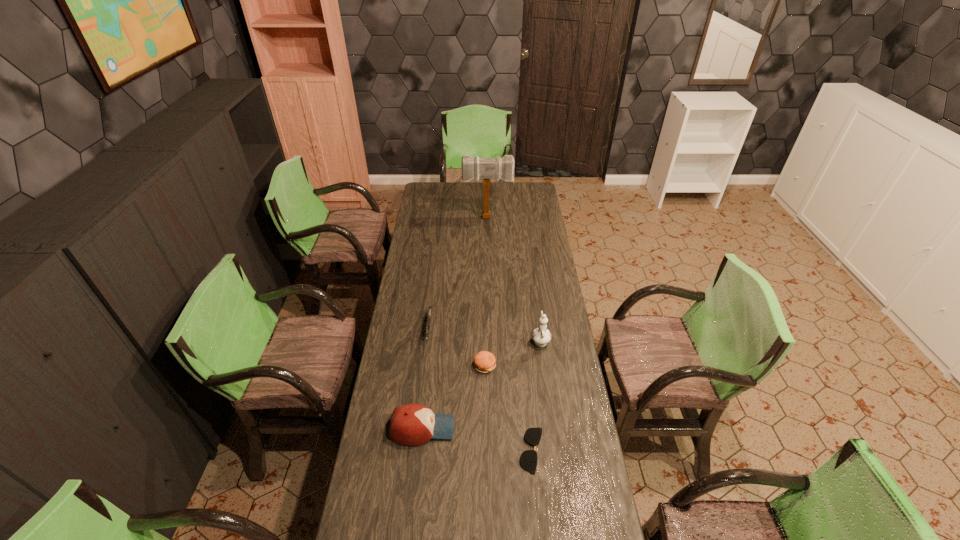
Locate an element on the screen. mallet is located at coordinates (476, 168).

Where is `the farthest object`? Image resolution: width=960 pixels, height=540 pixels. the farthest object is located at coordinates (476, 168).

Image resolution: width=960 pixels, height=540 pixels. Identify the location of the fifth shortest object. (541, 335).

Where is `baseball cap`? The height and width of the screenshot is (540, 960). baseball cap is located at coordinates (413, 424).

Where is `gun`? This screenshot has width=960, height=540. gun is located at coordinates click(430, 308).

Locate an element on the screen. Image resolution: width=960 pixels, height=540 pixels. the fourth farthest object is located at coordinates (484, 361).

Where is `the second shortest object`? Image resolution: width=960 pixels, height=540 pixels. the second shortest object is located at coordinates (484, 361).

Where is `spectacles`? spectacles is located at coordinates (x=528, y=459).

I want to click on vacant space positioned on the left of the farthest object, so click(447, 218).

Locate an element on the screen. Image resolution: width=960 pixels, height=540 pixels. free location located at the spout of the second tallest object is located at coordinates (536, 303).